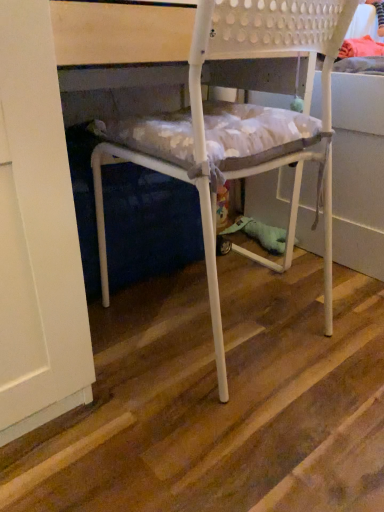
What are the coordinates of `vacant region in front of white matte plastic chair at center` in the screenshot? It's located at (204, 430).